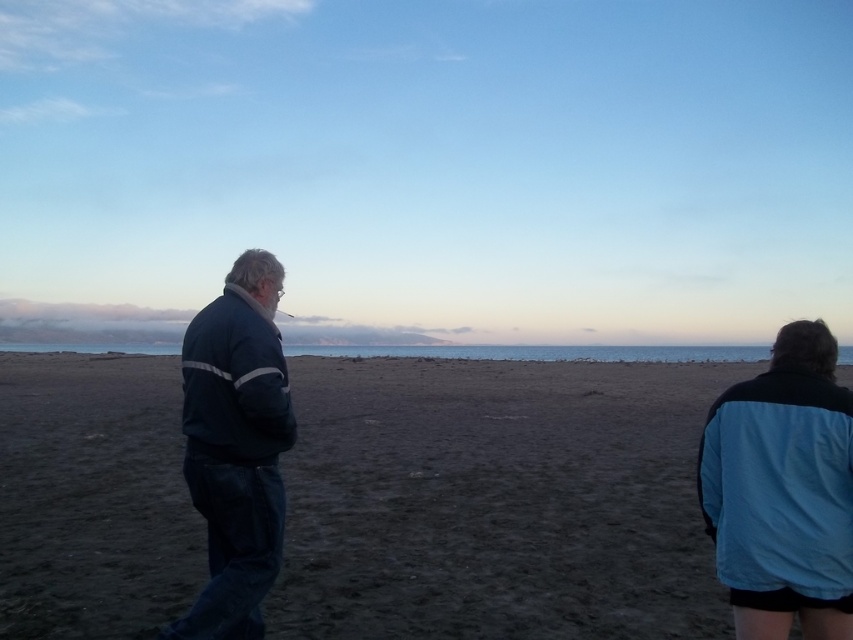
Between blue fabric jacket at lower right and dark blue fabric jacket at left, which one appears on the left side from the viewer's perspective?

From the viewer's perspective, dark blue fabric jacket at left appears more on the left side.

Between blue fabric jacket at lower right and dark blue fabric jacket at left, which one is positioned lower?

blue fabric jacket at lower right is lower down.

Which is behind, point (836, 484) or point (244, 488)?

Point (244, 488)

This screenshot has height=640, width=853. What are the coordinates of `blue fabric jacket at lower right` in the screenshot? It's located at (782, 490).

Measure the distance between point (659, 483) and camera.

9.92 meters

The height and width of the screenshot is (640, 853). What are the coordinates of `dark sand at center` in the screenshot? It's located at (497, 500).

What are the coordinates of `dark sand at center` in the screenshot? It's located at (497, 500).

Is dark sand at center bigger than blue fabric jacket at lower right?

Indeed, dark sand at center has a larger size compared to blue fabric jacket at lower right.

Can you confirm if dark sand at center is wider than blue fabric jacket at lower right?

Yes.

Measure the distance between dark sand at center and camera.

dark sand at center is 4.78 meters away from camera.

Where is `dark sand at center`? The height and width of the screenshot is (640, 853). dark sand at center is located at coordinates (497, 500).